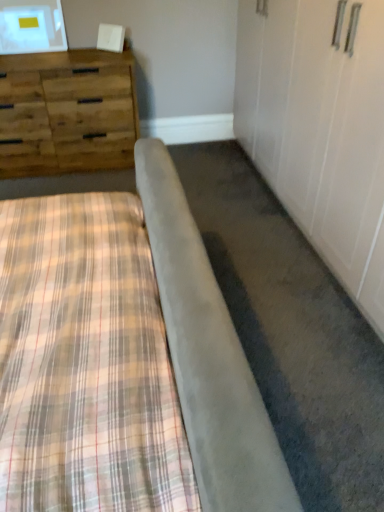
Describe the element at coordinates (67, 112) in the screenshot. The image size is (384, 512). I see `woodenmaterial/texturechest of drawers at upper left` at that location.

The image size is (384, 512). Find the location of `woodenmaterial/texturechest of drawers at upper left`. woodenmaterial/texturechest of drawers at upper left is located at coordinates [67, 112].

At what (x,y) coordinates should I click in order to perform the action: click on plaid fabric bed at lower left. Please return your answer as a coordinate pair (x, y). This screenshot has height=512, width=384. Looking at the image, I should click on (125, 360).

This screenshot has height=512, width=384. What do you see at coordinates (125, 360) in the screenshot?
I see `plaid fabric bed at lower left` at bounding box center [125, 360].

Locate an element on the screen. woodenmaterial/texturechest of drawers at upper left is located at coordinates (67, 112).

In the scene shown: Does woodenmaterial/texturechest of drawers at upper left appear on the left side of plaid fabric bed at lower left?

Yes, woodenmaterial/texturechest of drawers at upper left is to the left of plaid fabric bed at lower left.

In the scene shown: Which is in front, woodenmaterial/texturechest of drawers at upper left or plaid fabric bed at lower left?

plaid fabric bed at lower left.

Is point (124, 138) more distant than point (31, 307)?

Yes, point (124, 138) is farther from viewer.

From the image's perspective, which object appears higher, woodenmaterial/texturechest of drawers at upper left or plaid fabric bed at lower left?

woodenmaterial/texturechest of drawers at upper left appears higher in the image.

From a real-world perspective, who is located lower, woodenmaterial/texturechest of drawers at upper left or plaid fabric bed at lower left?

plaid fabric bed at lower left, from a real-world perspective.

Is woodenmaterial/texturechest of drawers at upper left wider or thinner than plaid fabric bed at lower left?

In the image, woodenmaterial/texturechest of drawers at upper left appears to be more narrow than plaid fabric bed at lower left.

Considering the sizes of objects woodenmaterial/texturechest of drawers at upper left and plaid fabric bed at lower left in the image provided, who is shorter, woodenmaterial/texturechest of drawers at upper left or plaid fabric bed at lower left?

Standing shorter between the two is plaid fabric bed at lower left.

Considering the sizes of woodenmaterial/texturechest of drawers at upper left and plaid fabric bed at lower left in the image, is woodenmaterial/texturechest of drawers at upper left bigger or smaller than plaid fabric bed at lower left?

In the image, woodenmaterial/texturechest of drawers at upper left appears to be smaller than plaid fabric bed at lower left.

Is plaid fabric bed at lower left completely or partially inside woodenmaterial/texturechest of drawers at upper left?

No, plaid fabric bed at lower left is not surrounded by woodenmaterial/texturechest of drawers at upper left.

Is woodenmaterial/texturechest of drawers at upper left not close to plaid fabric bed at lower left?

Yes, woodenmaterial/texturechest of drawers at upper left and plaid fabric bed at lower left are located far from each other.

Is woodenmaterial/texturechest of drawers at upper left looking in the opposite direction of plaid fabric bed at lower left?

No.

What's the angular difference between woodenmaterial/texturechest of drawers at upper left and plaid fabric bed at lower left's facing directions?

The angular difference between woodenmaterial/texturechest of drawers at upper left and plaid fabric bed at lower left is 90.1 degrees.

Measure the distance between woodenmaterial/texturechest of drawers at upper left and plaid fabric bed at lower left.

1.75 meters.

Where is `bed below the woodenmaterial/texturechest of drawers at upper left (from the image's perspective)`? This screenshot has width=384, height=512. bed below the woodenmaterial/texturechest of drawers at upper left (from the image's perspective) is located at coordinates (125, 360).

Which object is positioned more to the left, plaid fabric bed at lower left or woodenmaterial/texturechest of drawers at upper left?

From the viewer's perspective, woodenmaterial/texturechest of drawers at upper left appears more on the left side.

Considering their positions, is plaid fabric bed at lower left located in front of or behind woodenmaterial/texturechest of drawers at upper left?

plaid fabric bed at lower left is in front of woodenmaterial/texturechest of drawers at upper left.

Between point (262, 429) and point (33, 106), which one is positioned behind?

The point (33, 106) is behind.

From the image's perspective, is plaid fabric bed at lower left above woodenmaterial/texturechest of drawers at upper left?

No, from the image's perspective, plaid fabric bed at lower left is not over woodenmaterial/texturechest of drawers at upper left.

From a real-world perspective, is plaid fabric bed at lower left physically above woodenmaterial/texturechest of drawers at upper left?

No.

Which object is wider, plaid fabric bed at lower left or woodenmaterial/texturechest of drawers at upper left?

Wider between the two is plaid fabric bed at lower left.

From their relative heights in the image, would you say plaid fabric bed at lower left is taller or shorter than woodenmaterial/texturechest of drawers at upper left?

Clearly, plaid fabric bed at lower left is shorter compared to woodenmaterial/texturechest of drawers at upper left.

Is plaid fabric bed at lower left bigger than woodenmaterial/texturechest of drawers at upper left?

Yes, plaid fabric bed at lower left is bigger than woodenmaterial/texturechest of drawers at upper left.

Is woodenmaterial/texturechest of drawers at upper left surrounded by plaid fabric bed at lower left?

No, woodenmaterial/texturechest of drawers at upper left is not a part of plaid fabric bed at lower left.

Does plaid fabric bed at lower left touch woodenmaterial/texturechest of drawers at upper left?

No, plaid fabric bed at lower left is not making contact with woodenmaterial/texturechest of drawers at upper left.

Does plaid fabric bed at lower left turn towards woodenmaterial/texturechest of drawers at upper left?

No, plaid fabric bed at lower left is not turned towards woodenmaterial/texturechest of drawers at upper left.

How many degrees apart are the facing directions of plaid fabric bed at lower left and woodenmaterial/texturechest of drawers at upper left?

plaid fabric bed at lower left and woodenmaterial/texturechest of drawers at upper left are facing 90.1 degrees away from each other.

How much distance is there between plaid fabric bed at lower left and woodenmaterial/texturechest of drawers at upper left?

The distance of plaid fabric bed at lower left from woodenmaterial/texturechest of drawers at upper left is 5.75 feet.

You are a GUI agent. You are given a task and a screenshot of the screen. Output one action in this format:
    pyautogui.click(x=<x>, y=<y>)
    Task: Click on the chest of drawers located above the plaid fabric bed at lower left (from a real-world perspective)
    
    Given the screenshot: What is the action you would take?
    pyautogui.click(x=67, y=112)

Find the location of a particular element. The image size is (384, 512). chest of drawers on the left of plaid fabric bed at lower left is located at coordinates (67, 112).

The image size is (384, 512). In order to click on bed directly beneath the woodenmaterial/texturechest of drawers at upper left (from a real-world perspective) in this screenshot , I will do `click(125, 360)`.